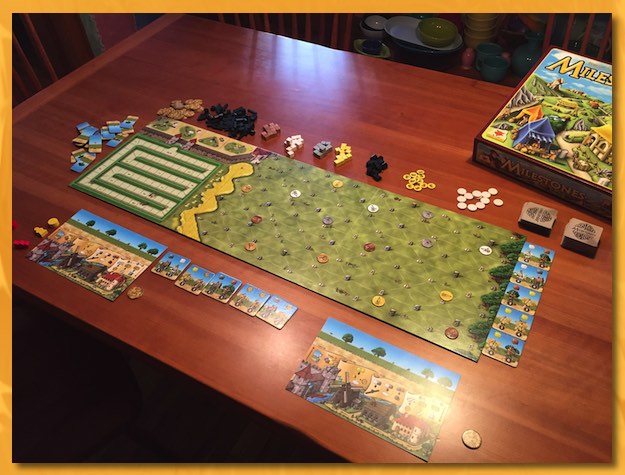
Find the location of `empty space bottom right of table`. empty space bottom right of table is located at coordinates (562, 407).